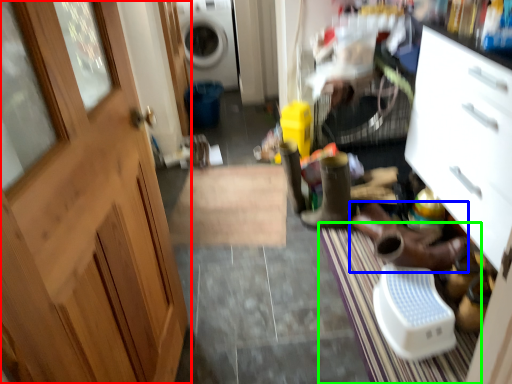
Question: Which is nearer to the door (highlighted by a red box)? footwear (highlighted by a blue box) or doormat (highlighted by a green box).

Choices:
 (A) footwear
 (B) doormat

Answer: (B)